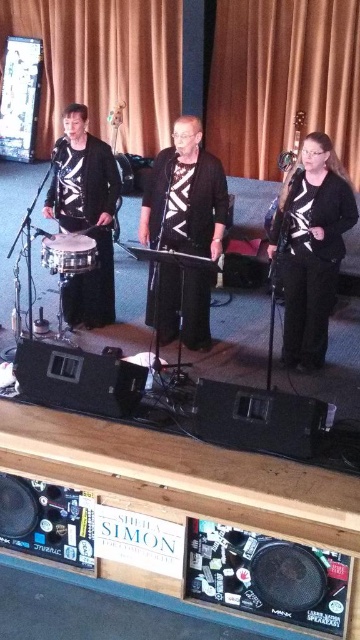
Is black matte jacket at center thinner than black matte guitar at right?

In fact, black matte jacket at center might be wider than black matte guitar at right.

Can you confirm if black matte jacket at center is positioned above black matte guitar at right?

Yes, black matte jacket at center is above black matte guitar at right.

Is point (168, 246) behind point (316, 198)?

Yes, point (168, 246) is farther from viewer.

I want to click on black matte jacket at center, so click(185, 195).

Can you confirm if black matte jacket at center is wider than matte silver drum at left?

Indeed, black matte jacket at center has a greater width compared to matte silver drum at left.

Looking at this image, measure the distance between point (209,188) and camera.

Point (209,188) is 4.06 meters from camera.

Identify the location of black matte jacket at center. (185, 195).

Between black matte jacket at center and matte black drum at left, which one appears on the right side from the viewer's perspective?

black matte jacket at center

At what (x,y) coordinates should I click in order to perform the action: click on black matte jacket at center. Please return your answer as a coordinate pair (x, y). The width and height of the screenshot is (360, 640). Looking at the image, I should click on click(x=185, y=195).

Locate an element on the screen. This screenshot has height=640, width=360. black matte jacket at center is located at coordinates (185, 195).